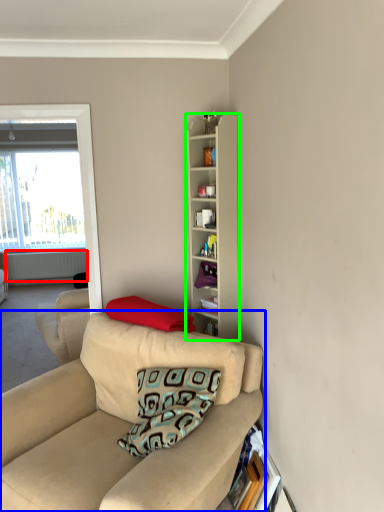
Question: Based on their relative distances, which object is farther from radiator (highlighted by a red box)? Choose from studio couch (highlighted by a blue box) and cabinetry (highlighted by a green box).

Choices:
 (A) studio couch
 (B) cabinetry

Answer: (A)